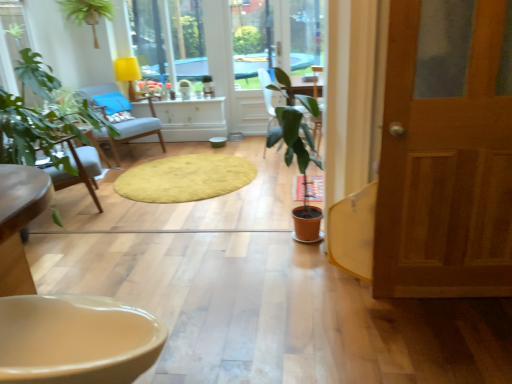
Locate an element on the screen. Image resolution: width=512 pixels, height=384 pixels. free space in front of wooden door at right is located at coordinates 453,342.